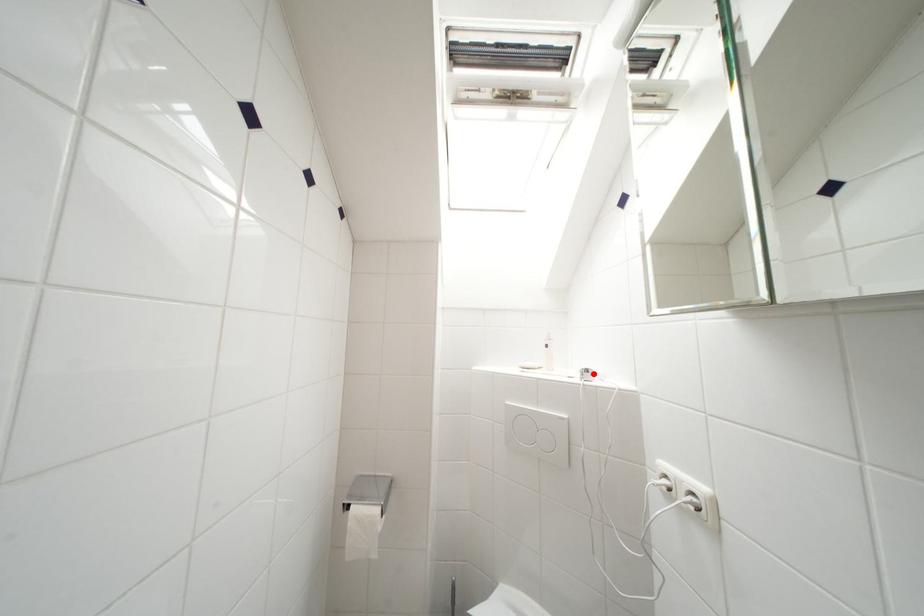
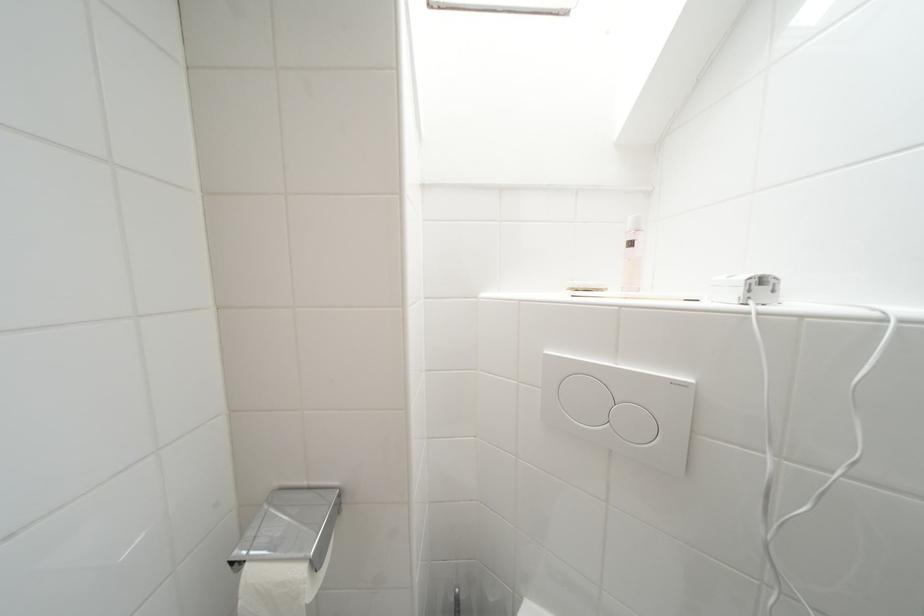
Find the pixel in the second image that matches the highlighted location in the first image.

(769, 283)